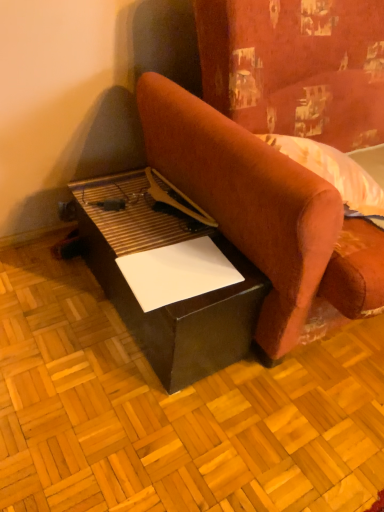
Image resolution: width=384 pixels, height=512 pixels. In order to click on free space in front of black leather table at lower left in this screenshot , I will do `click(135, 423)`.